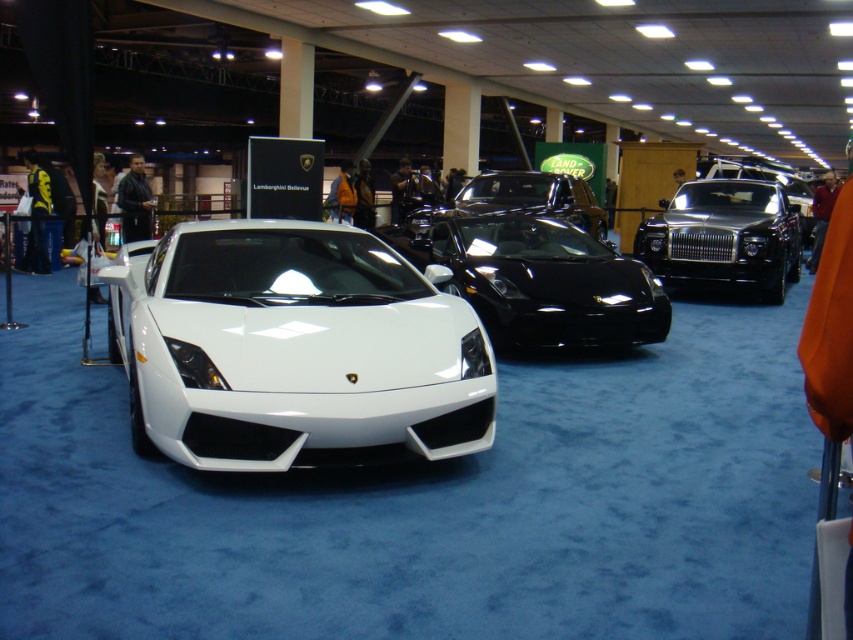
Question: Does white glossy sports car at center appear on the right side of glossy black car at center?

Choices:
 (A) yes
 (B) no

Answer: (B)

Question: Which point is closer to the camera?

Choices:
 (A) (715, 253)
 (B) (569, 208)

Answer: (A)

Question: Can you confirm if black metallic sedan at right is positioned above glossy black car at center?

Choices:
 (A) no
 (B) yes

Answer: (A)

Question: Estimate the real-world distances between objects in this image. Which object is closer to the black metallic sedan at right?

Choices:
 (A) glossy black car at center
 (B) white glossy sports car at center

Answer: (A)

Question: Does white glossy sports car at center appear on the left side of black metallic sedan at right?

Choices:
 (A) yes
 (B) no

Answer: (A)

Question: Among these objects, which one is nearest to the camera?

Choices:
 (A) black metallic sedan at right
 (B) glossy black car at center

Answer: (A)